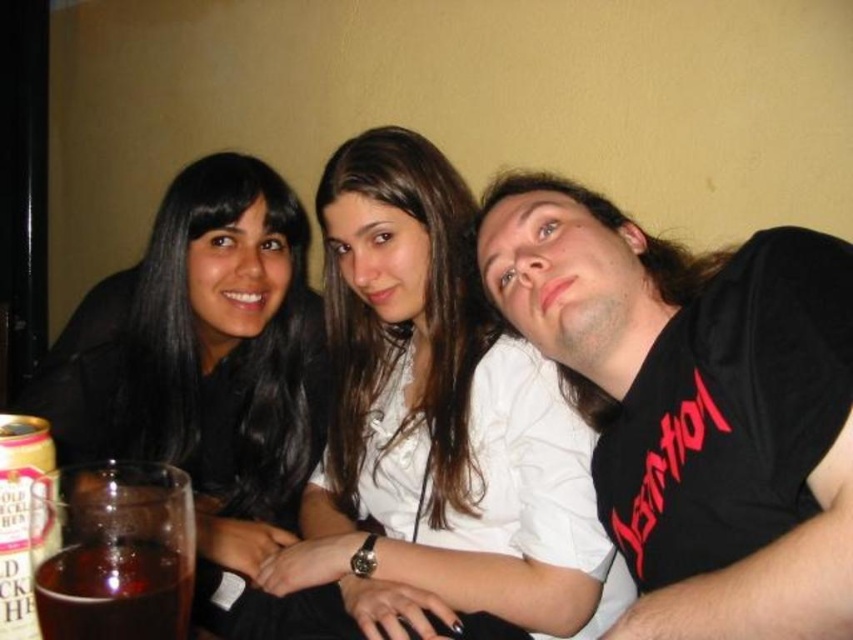
You are standing in a dimly lit room with three people sitting closely together. You see a point at coordinates (260, 440). Can you reach that point without moving closer than 5 feet to it?

The distance between you and the point (260, 440) is 5.26 feet, so you can reach it without moving closer than 5 feet because the distance is slightly more than 5 feet.

You are a photographer setting up a camera to capture the scene. You notice the black matte hair at upper left and the translucent glass at lower left. Which object should you focus on first if you want to ensure both are in focus, given their relative heights?

The black matte hair at upper left is taller than the translucent glass at lower left, so focusing on the black matte hair at upper left first would help ensure both are in focus since it is the taller object.